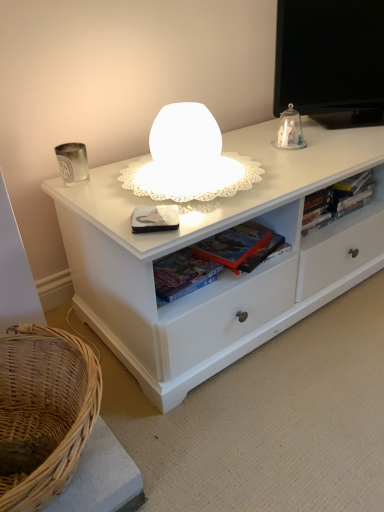
Locate an element on the screen. The height and width of the screenshot is (512, 384). hardcover book at right, which appears as the third book when viewed from the left is located at coordinates (342, 202).

What do you see at coordinates (202, 267) in the screenshot? The width and height of the screenshot is (384, 512). I see `hardcover book at center, the second book positioned from the right` at bounding box center [202, 267].

How much space does hardcover book at center, which appears as the second book when viewed from the left, occupy horizontally?

The width of hardcover book at center, which appears as the second book when viewed from the left, is 21.66 centimeters.

In order to face white matte paperback book at center, should I rotate leftwards or rightwards?

You should rotate left by 5.061 degrees.

The height and width of the screenshot is (512, 384). Describe the element at coordinates (182, 275) in the screenshot. I see `hardcover book at center, which ranks as the 1th book in left-to-right order` at that location.

In order to click on hardcover book at right, the first book when ordered from right to left in this screenshot , I will do `click(342, 202)`.

Could woven natural basket at lower left be considered to be inside hardcover book at center, which appears as the second book when viewed from the left?

No, hardcover book at center, which appears as the second book when viewed from the left, does not contain woven natural basket at lower left.

Can you confirm if hardcover book at center, the second book positioned from the right, is shorter than woven natural basket at lower left?

Indeed, hardcover book at center, the second book positioned from the right, has a lesser height compared to woven natural basket at lower left.

From the image's perspective, who appears lower, hardcover book at center, which appears as the second book when viewed from the left, or woven natural basket at lower left?

woven natural basket at lower left, from the image's perspective.

From a real-world perspective, is hardcover book at center, which appears as the second book when viewed from the left, physically located above or below woven natural basket at lower left?

From a real-world perspective, hardcover book at center, which appears as the second book when viewed from the left, is physically above woven natural basket at lower left.

Is hardcover book at right, which appears as the third book when viewed from the left, positioned before hardcover book at center, the second book positioned from the right?

That is False.

Is hardcover book at center, which appears as the second book when viewed from the left, inside hardcover book at right, which appears as the third book when viewed from the left?

No.

From the image's perspective, which is below, hardcover book at right, the first book when ordered from right to left, or hardcover book at center, which appears as the second book when viewed from the left?

hardcover book at center, which appears as the second book when viewed from the left, appears lower in the image.

How different are the orientations of hardcover book at right, which appears as the third book when viewed from the left, and hardcover book at center, the second book positioned from the right, in degrees?

hardcover book at right, which appears as the third book when viewed from the left, and hardcover book at center, the second book positioned from the right, are facing 5.28 degrees away from each other.

Considering the sizes of white matte paperback book at center and hardcover book at right, the first book when ordered from right to left, in the image, is white matte paperback book at center taller or shorter than hardcover book at right, the first book when ordered from right to left,?

Clearly, white matte paperback book at center is shorter compared to hardcover book at right, the first book when ordered from right to left.

The width and height of the screenshot is (384, 512). Find the location of `book that is the 3rd object to the right of the white matte paperback book at center, starting at the anchor`. book that is the 3rd object to the right of the white matte paperback book at center, starting at the anchor is located at coordinates (342, 202).

From the image's perspective, is white matte paperback book at center beneath hardcover book at right, the first book when ordered from right to left?

Yes, from the image's perspective, white matte paperback book at center is below hardcover book at right, the first book when ordered from right to left.

Looking at this image, what's the angular difference between white matte paperback book at center and hardcover book at right, the first book when ordered from right to left,'s facing directions?

34.4 degrees separate the facing orientations of white matte paperback book at center and hardcover book at right, the first book when ordered from right to left.

Which book is the 3rd one when counting from the right side of the white matte paperback book at center? Please provide its 2D coordinates.

[(342, 202)]

Considering the relative sizes of hardcover book at right, the first book when ordered from right to left, and white matte paperback book at center in the image provided, is hardcover book at right, the first book when ordered from right to left, smaller than white matte paperback book at center?

Incorrect, hardcover book at right, the first book when ordered from right to left, is not smaller in size than white matte paperback book at center.

Is hardcover book at right, the first book when ordered from right to left, placed right next to white matte paperback book at center?

No.

Find the location of a particular element. This screenshot has height=512, width=384. paperback book above the hardcover book at center, which appears as the second book when viewed from the left (from the image's perspective) is located at coordinates (155, 218).

Would you say hardcover book at center, which appears as the second book when viewed from the left, contains white matte paperback book at center?

Definitely not — white matte paperback book at center is not inside hardcover book at center, which appears as the second book when viewed from the left.

Is hardcover book at center, the second book positioned from the right, at the left side of white matte paperback book at center?

No.

How different are the orientations of hardcover book at center, which appears as the second book when viewed from the left, and white matte paperback book at center in degrees?

There is a 39.7-degree angle between the facing directions of hardcover book at center, which appears as the second book when viewed from the left, and white matte paperback book at center.

Considering the relative sizes of hardcover book at right, the first book when ordered from right to left, and hardcover book at center, which ranks as the 1th book in left-to-right order, in the image provided, is hardcover book at right, the first book when ordered from right to left, bigger than hardcover book at center, which ranks as the 1th book in left-to-right order,?

Yes.

Considering the sizes of objects hardcover book at right, which appears as the third book when viewed from the left, and hardcover book at center, which ranks as the 1th book in left-to-right order, in the image provided, who is thinner, hardcover book at right, which appears as the third book when viewed from the left, or hardcover book at center, which ranks as the 1th book in left-to-right order,?

With smaller width is hardcover book at center, which ranks as the 1th book in left-to-right order.

Does point (337, 191) appear closer or farther from the camera than point (177, 271)?

Clearly, point (337, 191) is more distant from the camera than point (177, 271).

Considering the sizes of white matte paperback book at center and hardcover book at center, the 3th book viewed from the right, in the image, is white matte paperback book at center bigger or smaller than hardcover book at center, the 3th book viewed from the right,?

Considering their sizes, white matte paperback book at center takes up less space than hardcover book at center, the 3th book viewed from the right.

Is white matte paperback book at center positioned with its back to hardcover book at center, which ranks as the 1th book in left-to-right order?

No, white matte paperback book at center is not facing the opposite direction of hardcover book at center, which ranks as the 1th book in left-to-right order.

From their relative heights in the image, would you say white matte paperback book at center is taller or shorter than hardcover book at center, which ranks as the 1th book in left-to-right order?

Considering their sizes, white matte paperback book at center has less height than hardcover book at center, which ranks as the 1th book in left-to-right order.

Locate an element on the screen. The width and height of the screenshot is (384, 512). basket that is on the left side of hardcover book at center, which appears as the second book when viewed from the left is located at coordinates (46, 407).

You are a GUI agent. You are given a task and a screenshot of the screen. Output one action in this format:
    pyautogui.click(x=<x>, y=<y>)
    Task: Click on the book that is above the hardcover book at center, which appears as the second book when viewed from the left (from the image's perspective)
    
    Given the screenshot: What is the action you would take?
    pyautogui.click(x=342, y=202)

From the image, which object appears to be farther from woven natural basket at lower left, clear glass dome at upper right or hardcover book at center, the second book positioned from the right?

clear glass dome at upper right lies further to woven natural basket at lower left than the other object.

From the image, which object appears to be farther from hardcover book at right, the first book when ordered from right to left, clear glass dome at upper right or hardcover book at center, the second book positioned from the right?

Based on the image, hardcover book at center, the second book positioned from the right, appears to be further to hardcover book at right, the first book when ordered from right to left.

Which object lies nearer to the anchor point hardcover book at center, the second book positioned from the right, hardcover book at right, which appears as the third book when viewed from the left, or clear glass dome at upper right?

The object closer to hardcover book at center, the second book positioned from the right, is hardcover book at right, which appears as the third book when viewed from the left.

Looking at the image, which one is located closer to hardcover book at center, which appears as the second book when viewed from the left, hardcover book at center, which ranks as the 1th book in left-to-right order, or woven natural basket at lower left?

hardcover book at center, which ranks as the 1th book in left-to-right order, lies closer to hardcover book at center, which appears as the second book when viewed from the left, than the other object.

From the image, which object appears to be farther from white matte paperback book at center, clear glass dome at upper right or woven natural basket at lower left?

Among the two, clear glass dome at upper right is located further to white matte paperback book at center.

From the image, which object appears to be nearer to white matte paperback book at center, woven natural basket at lower left or hardcover book at center, which appears as the second book when viewed from the left?

hardcover book at center, which appears as the second book when viewed from the left.

Considering their positions, is woven natural basket at lower left positioned closer to hardcover book at center, which ranks as the 1th book in left-to-right order, than hardcover book at center, the second book positioned from the right?

hardcover book at center, the second book positioned from the right.

Looking at the image, which one is located closer to hardcover book at right, the first book when ordered from right to left, hardcover book at center, which appears as the second book when viewed from the left, or clear glass dome at upper right?

Among the two, clear glass dome at upper right is located nearer to hardcover book at right, the first book when ordered from right to left.

Locate an element on the screen. The image size is (384, 512). paperback book between woven natural basket at lower left and hardcover book at center, which appears as the second book when viewed from the left, in the front-back direction is located at coordinates (155, 218).

At what (x,y) coordinates should I click in order to perform the action: click on paperback book between woven natural basket at lower left and hardcover book at right, which appears as the third book when viewed from the left. Please return your answer as a coordinate pair (x, y). This screenshot has height=512, width=384. Looking at the image, I should click on (155, 218).

Locate an element on the screen. This screenshot has height=512, width=384. table lamp between woven natural basket at lower left and hardcover book at right, which appears as the third book when viewed from the left, from left to right is located at coordinates (290, 131).

Identify the location of paperback book that lies between clear glass dome at upper right and hardcover book at center, the 3th book viewed from the right, from top to bottom. This screenshot has height=512, width=384. (155, 218).